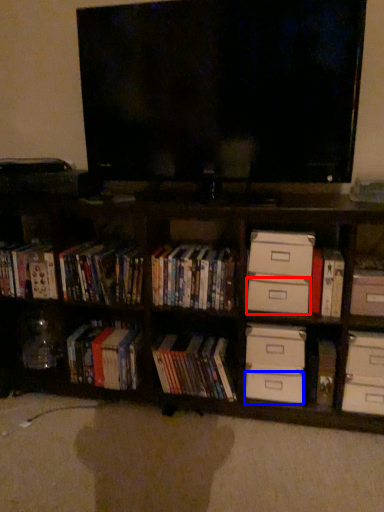
Question: Which object appears farthest to the camera in this image, drawer (highlighted by a red box) or drawer (highlighted by a blue box)?

Choices:
 (A) drawer
 (B) drawer

Answer: (B)